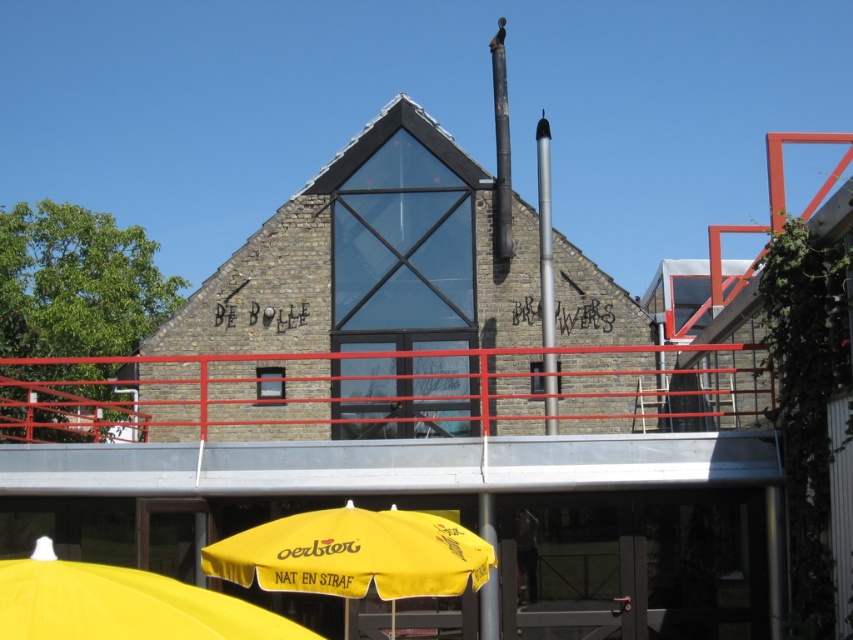
Question: Estimate the real-world distances between objects in this image. Which object is farther from the yellow fabric umbrella at lower center?

Choices:
 (A) yellow fabric umbrella at lower left
 (B) red metal railing at center

Answer: (B)

Question: Among these points, which one is farthest from the camera?

Choices:
 (A) (0, 561)
 (B) (579, 378)
 (C) (428, 554)

Answer: (B)

Question: Does red metal railing at center have a greater width compared to yellow fabric umbrella at lower center?

Choices:
 (A) yes
 (B) no

Answer: (A)

Question: Observing the image, what is the correct spatial positioning of yellow fabric umbrella at lower center in reference to yellow fabric umbrella at lower left?

Choices:
 (A) below
 (B) above

Answer: (A)

Question: Among these objects, which one is nearest to the camera?

Choices:
 (A) yellow fabric umbrella at lower left
 (B) red metal railing at center

Answer: (A)

Question: Is red metal railing at center thinner than yellow fabric umbrella at lower left?

Choices:
 (A) no
 (B) yes

Answer: (A)